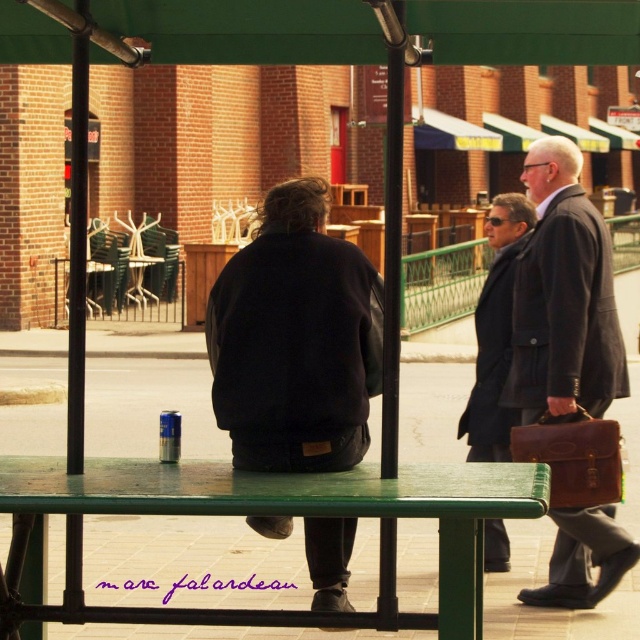
You are standing at the camera position and want to reach the point marked as point (344,561). If your walking speed is 3 feet per second, how many seconds will it take you to reach that point?

The point (344,561) is 19.59 feet away from the camera. At a walking speed of 3 feet per second, it will take 19.59 divided by 3, which is approximately 6.53 seconds to reach the point.

You are standing at the point with coordinates point (x=33, y=461) and want to walk to the entrance of the cafe located at point (x=276, y=339). Is the entrance in front of you or behind you?

The entrance at point (x=276, y=339) is in front of you because it is located in front of point (x=33, y=461) where you are standing.